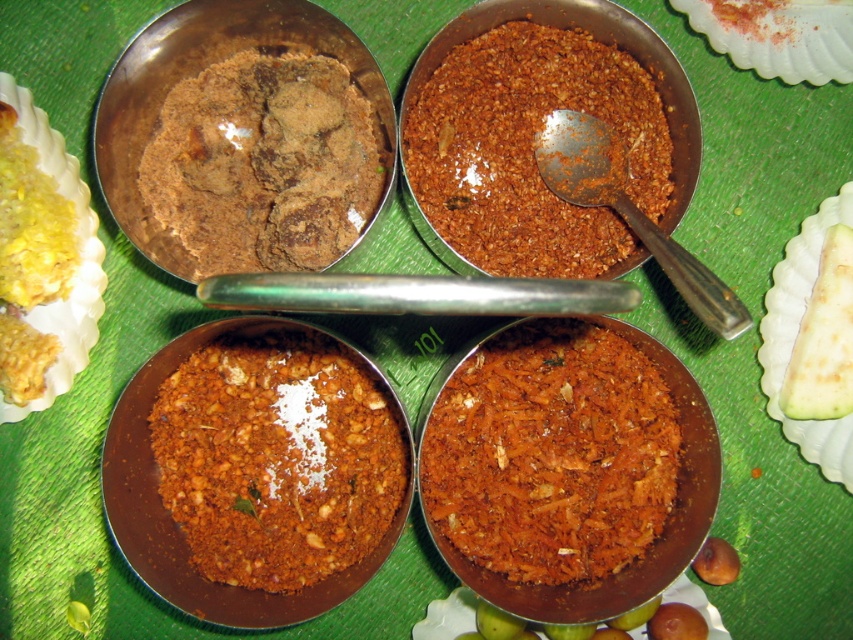
Based on the photo, is green matte cucumber at lower right closer to the viewer compared to yellow matte food at lower left?

No, it is behind yellow matte food at lower left.

Is green matte cucumber at lower right thinner than yellow matte food at lower left?

No.

Measure the distance between green matte cucumber at lower right and camera.

A distance of 3.87 feet exists between green matte cucumber at lower right and camera.

Identify the location of green matte cucumber at lower right. (822, 339).

Which of these two, brown crumbly spice mix at center or yellow creamy rice at upper left, stands shorter?

brown crumbly spice mix at center is shorter.

Between brown crumbly spice mix at center and yellow creamy rice at upper left, which one is positioned lower?

yellow creamy rice at upper left is lower down.

Is point (521, 65) less distant than point (48, 196)?

No.

Identify the location of brown crumbly spice mix at center. The height and width of the screenshot is (640, 853). (531, 148).

Does metallic spoon at upper right have a lesser width compared to green matte cucumber at lower right?

In fact, metallic spoon at upper right might be wider than green matte cucumber at lower right.

What do you see at coordinates (628, 211) in the screenshot? Image resolution: width=853 pixels, height=640 pixels. I see `metallic spoon at upper right` at bounding box center [628, 211].

Locate an element on the screen. metallic spoon at upper right is located at coordinates (628, 211).